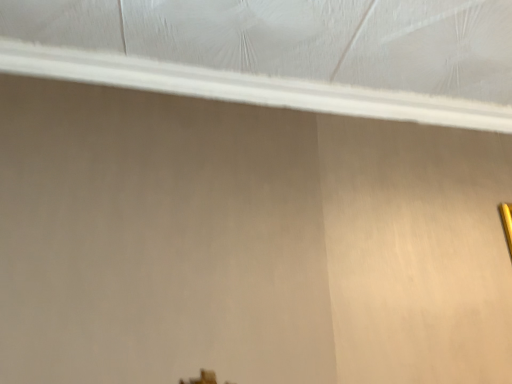
What do you see at coordinates (202, 378) in the screenshot?
I see `matte brown hair at lower center` at bounding box center [202, 378].

What is the approximate height of matte brown hair at lower center?

matte brown hair at lower center is 5.98 inches in height.

Locate an element on the screen. matte brown hair at lower center is located at coordinates (202, 378).

Locate an element on the screen. matte brown hair at lower center is located at coordinates (202, 378).